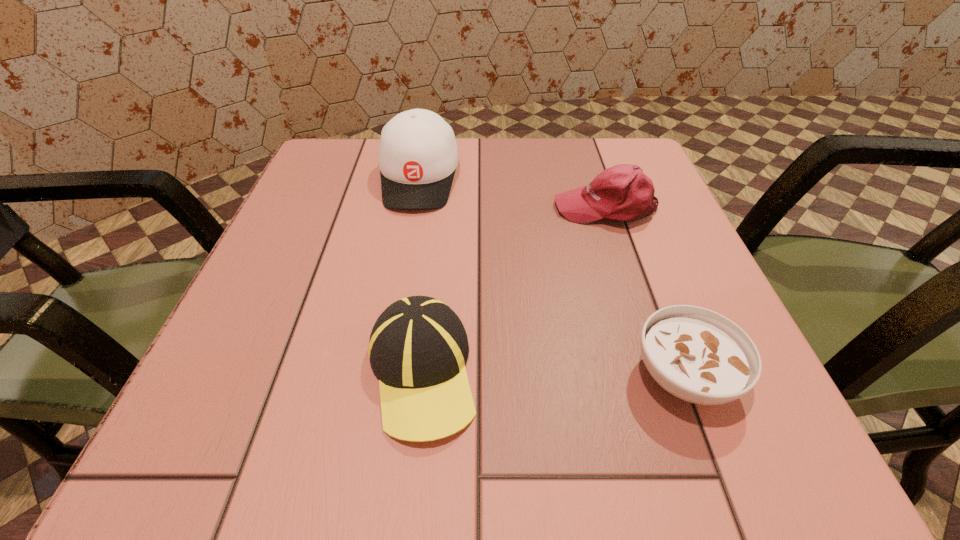
Image resolution: width=960 pixels, height=540 pixels. I want to click on free area in between the nearest baseball cap and the soup bowl, so click(553, 374).

The width and height of the screenshot is (960, 540). What are the coordinates of `unoccupied area between the nearest baseball cap and the soup bowl` in the screenshot? It's located at (553, 374).

This screenshot has width=960, height=540. In order to click on empty location between the tallest baseball cap and the rightmost baseball cap in this screenshot , I will do `click(513, 193)`.

Locate an element on the screen. object that can be found as the second closest to the shortest object is located at coordinates (623, 192).

This screenshot has height=540, width=960. Identify the location of object that is the third nearest to the rightmost baseball cap. (418, 347).

Select which baseball cap is the second closest to the tallest object. Please provide its 2D coordinates. Your answer should be formatted as a tuple, i.e. [(x, y)], where the tuple contains the x and y coordinates of a point satisfying the conditions above.

[(418, 347)]

Select which baseball cap appears as the closest to the shortest object. Please provide its 2D coordinates. Your answer should be formatted as a tuple, i.e. [(x, y)], where the tuple contains the x and y coordinates of a point satisfying the conditions above.

[(418, 347)]

At what (x,y) coordinates should I click in order to perform the action: click on vacant space that satisfies the following two spatial constraints: 1. on the front-facing side of the tallest baseball cap; 2. on the left side of the soup bowl. Please return your answer as a coordinate pair (x, y). Looking at the image, I should click on (384, 376).

I want to click on free spot that satisfies the following two spatial constraints: 1. at the front of the rightmost baseball cap with the brim; 2. with the brim of the nearest baseball cap facing forward, so click(x=661, y=373).

Identify the location of free space that satisfies the following two spatial constraints: 1. at the front of the rightmost baseball cap with the brim; 2. with the brim of the nearest baseball cap facing forward. (661, 373).